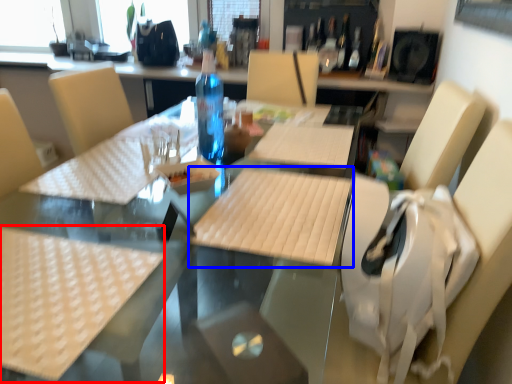
Question: Which object is closer to the camera taking this photo, tablecloth (highlighted by a red box) or plywood (highlighted by a blue box)?

Choices:
 (A) tablecloth
 (B) plywood

Answer: (A)